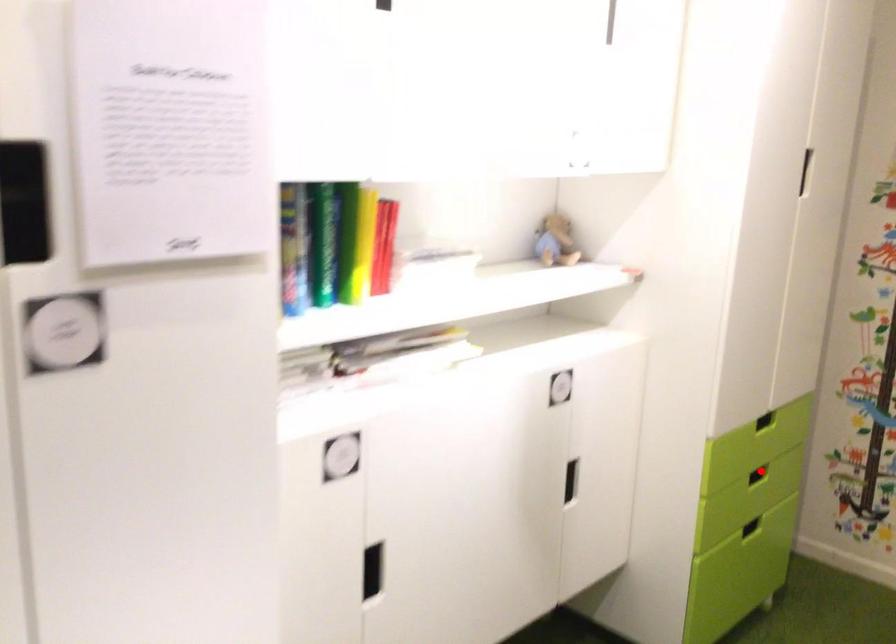
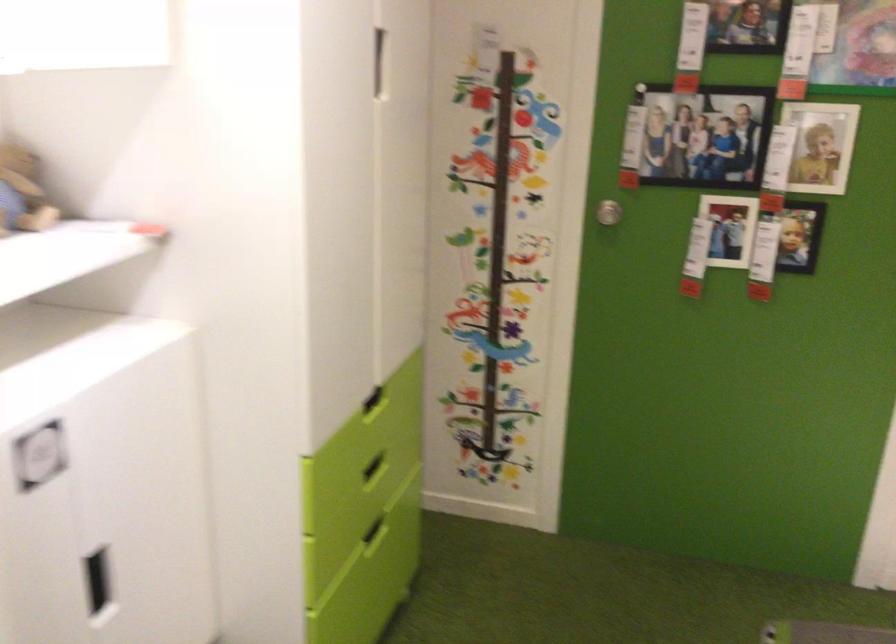
The point at the highlighted location is marked in the first image. Where is the corresponding point in the second image?

(374, 468)